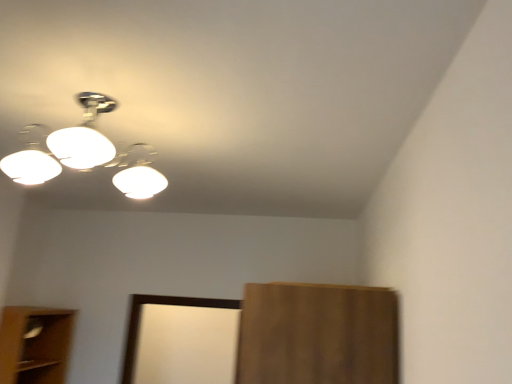
Describe the element at coordinates (87, 154) in the screenshot. The height and width of the screenshot is (384, 512). I see `matte white ceiling light at upper left` at that location.

Find the location of `matte white ceiling light at upper left`. matte white ceiling light at upper left is located at coordinates (87, 154).

Measure the distance between point (x=112, y=105) and camera.

A distance of 5.13 feet exists between point (x=112, y=105) and camera.

I want to click on matte white ceiling light at upper left, so pos(87,154).